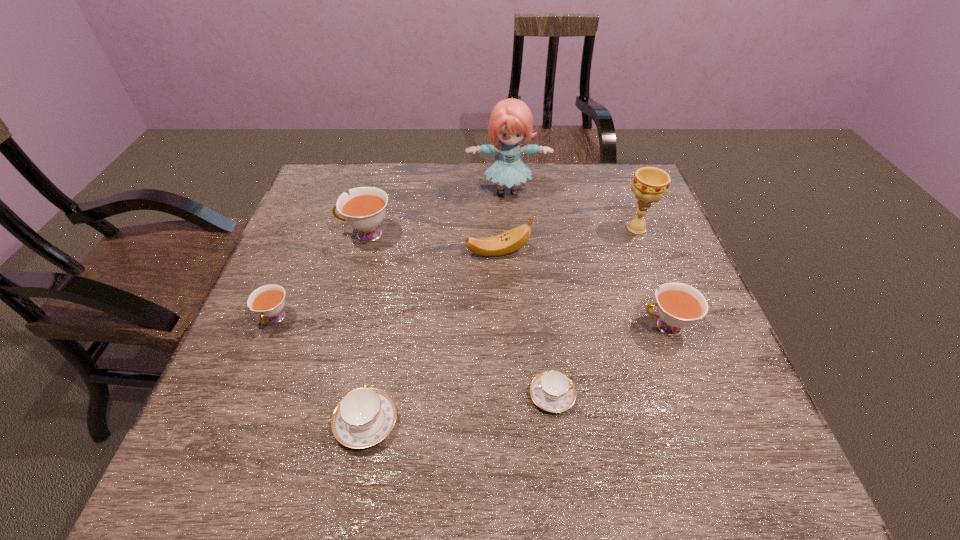
Where is `free region at the near edge of the desktop`? This screenshot has height=540, width=960. free region at the near edge of the desktop is located at coordinates (473, 486).

What are the coordinates of `vacant space at the left edge of the desktop` in the screenshot? It's located at (315, 265).

Find the location of a particular element. The width and height of the screenshot is (960, 540). vacant space at the right edge is located at coordinates (674, 402).

I want to click on free space at the far left corner, so click(304, 205).

Find the location of `vacant space at the far right corner of the desktop`. vacant space at the far right corner of the desktop is located at coordinates (612, 167).

This screenshot has width=960, height=540. I want to click on free space between the shortest teacup and the leftmost object, so click(414, 357).

Where is `empty space between the farthest teacup and the farthest object`? The width and height of the screenshot is (960, 540). empty space between the farthest teacup and the farthest object is located at coordinates (437, 213).

In order to click on blank region between the leftmost object and the chalice in this screenshot , I will do `click(456, 274)`.

Find the location of a particular element. This screenshot has width=960, height=540. vacant space that's between the doll and the chalice is located at coordinates (572, 210).

Where is `empty location between the yellow banana and the second white teacup from right to left`? empty location between the yellow banana and the second white teacup from right to left is located at coordinates (432, 243).